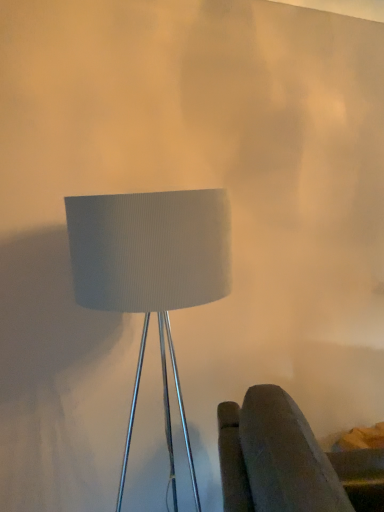
Locate an element on the screen. The width and height of the screenshot is (384, 512). white ribbed fabric lampshade at center is located at coordinates point(151,272).

Describe the element at coordinates (151, 272) in the screenshot. This screenshot has height=512, width=384. I see `white ribbed fabric lampshade at center` at that location.

Image resolution: width=384 pixels, height=512 pixels. What are the coordinates of `white ribbed fabric lampshade at center` in the screenshot? It's located at (151, 272).